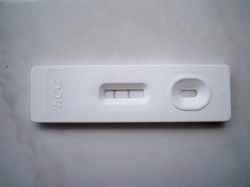
At what (x,y) coordinates should I click in order to perform the action: click on marble. Please return your answer as a coordinate pair (x, y). Looking at the image, I should click on (219, 143).